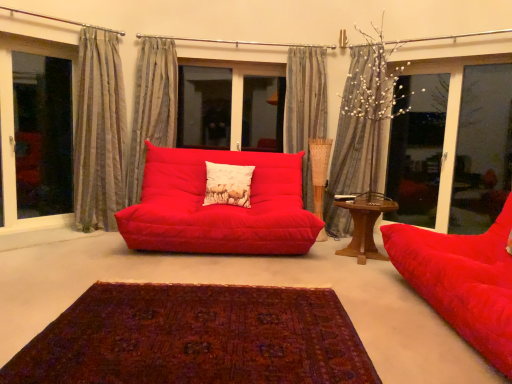
Question: Is gray striped curtain at upper right, the fourth curtain positioned from the left, taller or shorter than matte red beanbag at right, which is the 2th studio couch from left to right?

Choices:
 (A) tall
 (B) short

Answer: (A)

Question: Considering the positions of point (371, 72) and point (437, 256), is point (371, 72) closer or farther from the camera than point (437, 256)?

Choices:
 (A) closer
 (B) farther

Answer: (B)

Question: Estimate the real-world distances between objects in this image. Which object is closer to the wooden table at right?

Choices:
 (A) textured gray curtain at center, acting as the third curtain starting from the right
 (B) deep burgundy woven rug at center
 (C) gray striped curtain at upper center, the 2th curtain in the right-to-left sequence
 (D) matte red beanbag at right, which is the 2th studio couch from left to right
 (E) beige textured pillow at center

Answer: (D)

Question: Which object is positioned farthest from the gray striped curtain at upper center, arranged as the 3th curtain when viewed from the left?

Choices:
 (A) beige textured pillow at center
 (B) matte red studio couch at center, positioned as the second studio couch in front-to-back order
 (C) striped fabric curtain at left, the 1th curtain in the left-to-right sequence
 (D) transparent glass window at left, marked as the first window in a left-to-right arrangement
 (E) transparent glass window at right, positioned as the 1th window in right-to-left order

Answer: (D)